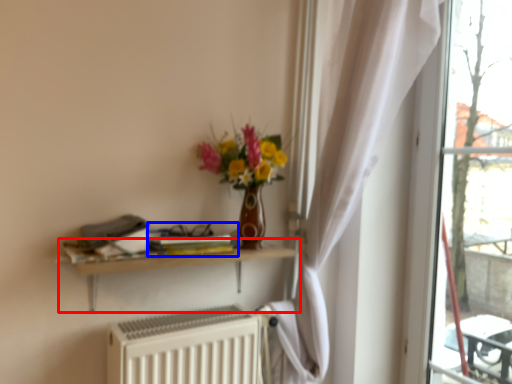
Question: Which object is further to the camera taking this photo, shelf (highlighted by a red box) or book (highlighted by a blue box)?

Choices:
 (A) shelf
 (B) book

Answer: (B)